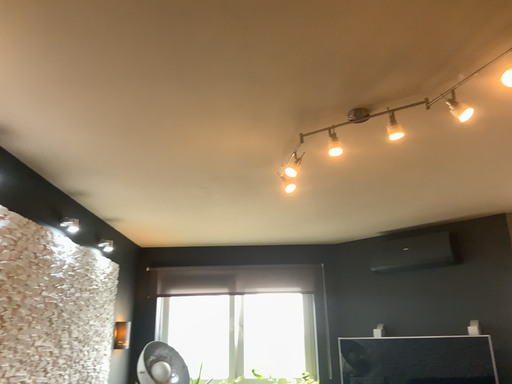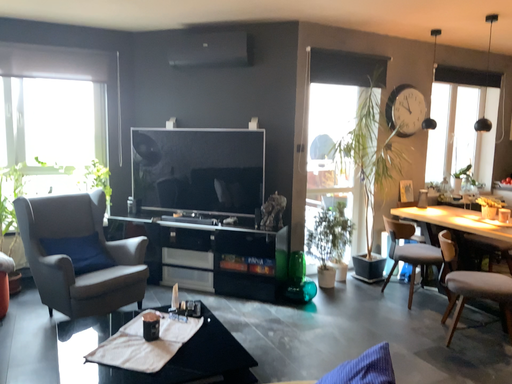
Question: How did the camera likely rotate when shooting the video?

Choices:
 (A) rotated downward
 (B) rotated upward

Answer: (A)